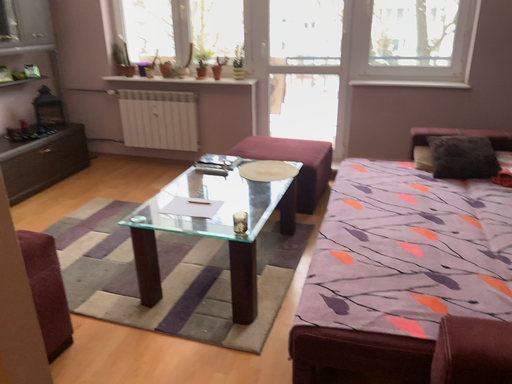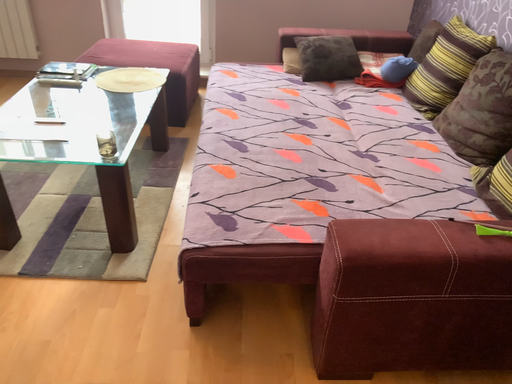
Question: Which way did the camera rotate in the video?

Choices:
 (A) rotated downward
 (B) rotated upward

Answer: (A)